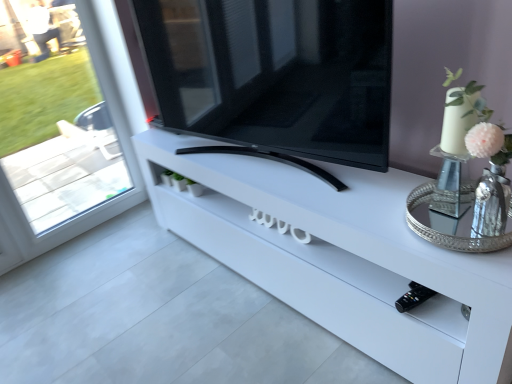
At what (x,y) coordinates should I click in order to perform the action: click on vacant space in between black glossy tv at center and silver metallic tray at right. Please return your answer as a coordinate pair (x, y). The height and width of the screenshot is (384, 512). Looking at the image, I should click on (337, 195).